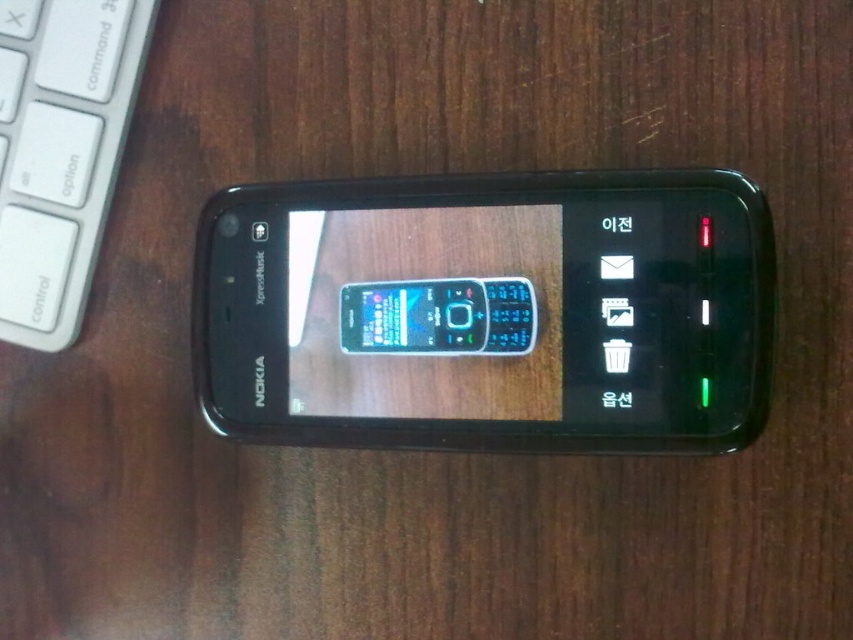
Does point (218, 262) come in front of point (45, 225)?

Yes, it is in front of point (45, 225).

I want to click on black glossy smartphone at center, so click(488, 310).

Locate an element on the screen. black glossy smartphone at center is located at coordinates (488, 310).